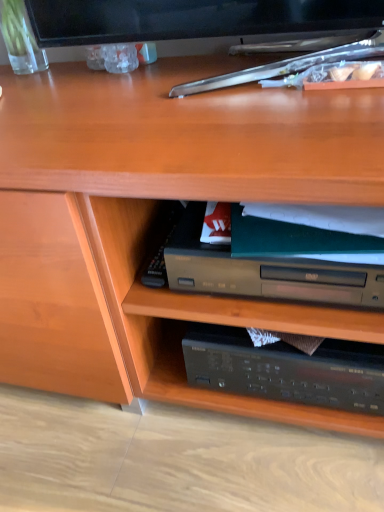
Measure the distance between clear glass vase at upper left and camera.

clear glass vase at upper left and camera are 31.22 inches apart.

You are a GUI agent. You are given a task and a screenshot of the screen. Output one action in this format:
    pyautogui.click(x=<x>, y=<y>)
    Task: Click on the clear glass vase at upper left
    
    Given the screenshot: What is the action you would take?
    pyautogui.click(x=20, y=39)

What do you see at coordinates (20, 39) in the screenshot?
I see `clear glass vase at upper left` at bounding box center [20, 39].

What is the approximate height of clear glass vase at upper left?

The height of clear glass vase at upper left is 6.12 inches.

The width and height of the screenshot is (384, 512). Identify the location of green matte paperback book at center. (272, 267).

Image resolution: width=384 pixels, height=512 pixels. Describe the element at coordinates (272, 267) in the screenshot. I see `green matte paperback book at center` at that location.

This screenshot has height=512, width=384. Identify the location of clear glass vase at upper left. (20, 39).

Is clear glass vase at upper left at the right side of green matte paperback book at center?

No.

Is clear glass vase at upper left positioned behind green matte paperback book at center?

Yes, clear glass vase at upper left is further from the viewer.

Does point (9, 0) come behind point (172, 239)?

That is True.

From the image's perspective, is clear glass vase at upper left above or below green matte paperback book at center?

Based on their image positions, clear glass vase at upper left is located above green matte paperback book at center.

From a real-world perspective, which object rests below the other?

From a 3D spatial view, green matte paperback book at center is below.

Between clear glass vase at upper left and green matte paperback book at center, which one has larger width?

green matte paperback book at center is wider.

Does clear glass vase at upper left have a lesser height compared to green matte paperback book at center?

No.

Considering the sizes of objects clear glass vase at upper left and green matte paperback book at center in the image provided, who is smaller, clear glass vase at upper left or green matte paperback book at center?

Smaller between the two is clear glass vase at upper left.

Is clear glass vase at upper left surrounding green matte paperback book at center?

No, green matte paperback book at center is not surrounded by clear glass vase at upper left.

Is clear glass vase at upper left next to green matte paperback book at center and touching it?

No, clear glass vase at upper left is not next to green matte paperback book at center.

Is green matte paperback book at center at the back of clear glass vase at upper left?

No, green matte paperback book at center is not at the back of clear glass vase at upper left.

Can you tell me how much clear glass vase at upper left and green matte paperback book at center differ in facing direction?

9.91e-05 degrees.

How distant is clear glass vase at upper left from green matte paperback book at center?

clear glass vase at upper left and green matte paperback book at center are 24.74 inches apart from each other.

At what (x,y) coordinates should I click in order to perform the action: click on glass vase on the left of green matte paperback book at center. Please return your answer as a coordinate pair (x, y). Looking at the image, I should click on (20, 39).

Considering the relative positions of green matte paperback book at center and clear glass vase at upper left in the image provided, is green matte paperback book at center to the right of clear glass vase at upper left from the viewer's perspective?

Correct, you'll find green matte paperback book at center to the right of clear glass vase at upper left.

From the picture: Which is in front, green matte paperback book at center or clear glass vase at upper left?

Positioned in front is green matte paperback book at center.

Is point (269, 267) less distant than point (9, 28)?

Yes, point (269, 267) is in front of point (9, 28).

From the image's perspective, is green matte paperback book at center over clear glass vase at upper left?

No, from the image's perspective, green matte paperback book at center is not above clear glass vase at upper left.

From a real-world perspective, who is located lower, green matte paperback book at center or clear glass vase at upper left?

green matte paperback book at center.

Between green matte paperback book at center and clear glass vase at upper left, which one has smaller width?

Thinner between the two is clear glass vase at upper left.

Is green matte paperback book at center taller or shorter than clear glass vase at upper left?

In the image, green matte paperback book at center appears to be shorter than clear glass vase at upper left.

Considering the relative sizes of green matte paperback book at center and clear glass vase at upper left in the image provided, is green matte paperback book at center smaller than clear glass vase at upper left?

Result: No, green matte paperback book at center is not smaller than clear glass vase at upper left.

From the picture: Is green matte paperback book at center outside of clear glass vase at upper left?

Yes, green matte paperback book at center is not within clear glass vase at upper left.

Are green matte paperback book at center and clear glass vase at upper left located far from each other?

No, green matte paperback book at center is not far away from clear glass vase at upper left.

Is green matte paperback book at center aimed at clear glass vase at upper left?

No, green matte paperback book at center does not turn towards clear glass vase at upper left.

Where is `paperback book located in front of the clear glass vase at upper left`? paperback book located in front of the clear glass vase at upper left is located at coordinates (272, 267).

What are the coordinates of `glass vase that is on the left side of green matte paperback book at center` in the screenshot? It's located at (20, 39).

Identify the location of glass vase lying above the green matte paperback book at center (from the image's perspective). (20, 39).